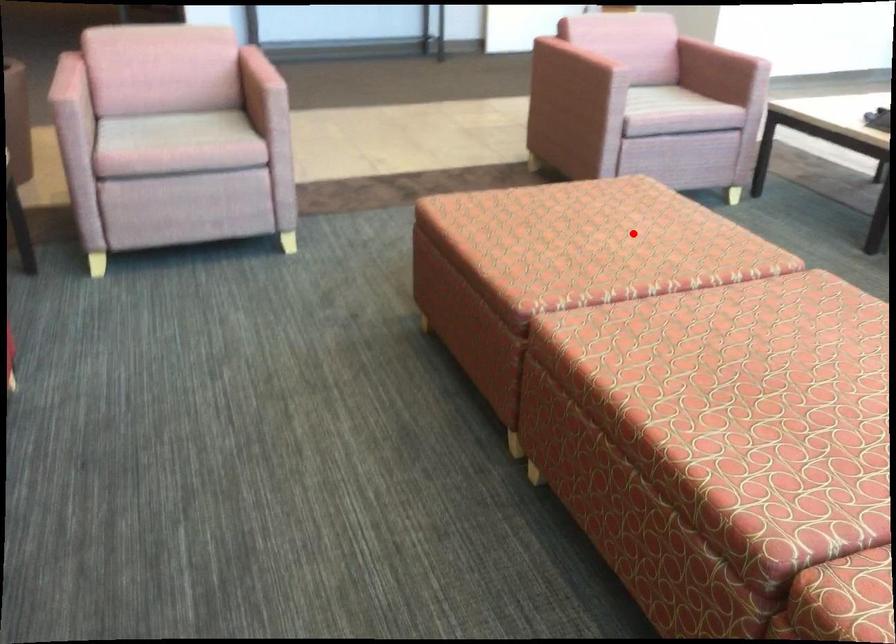
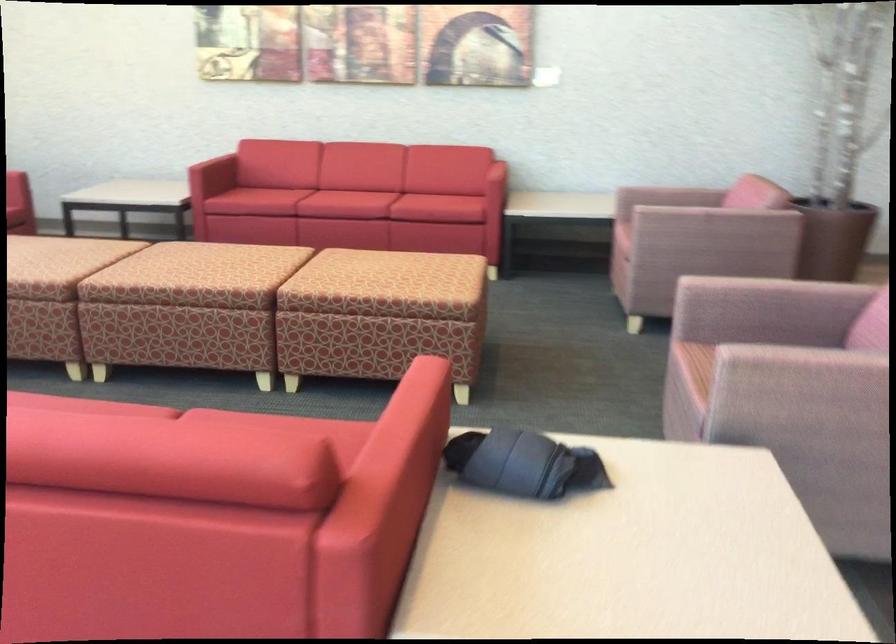
Find the pixel in the second image that matches the highlighted location in the first image.

(385, 270)